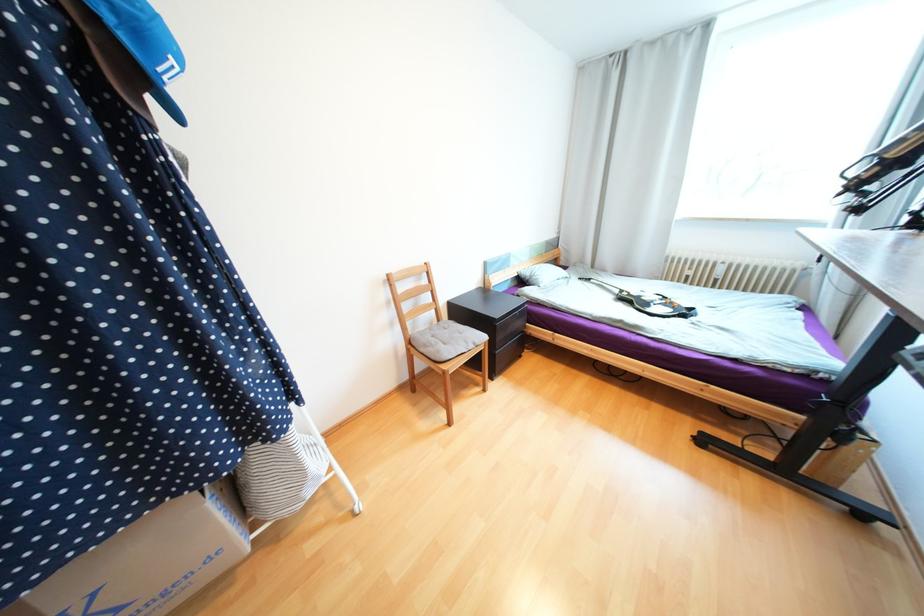
Where is `chair sitting surface`? chair sitting surface is located at coordinates (445, 339).